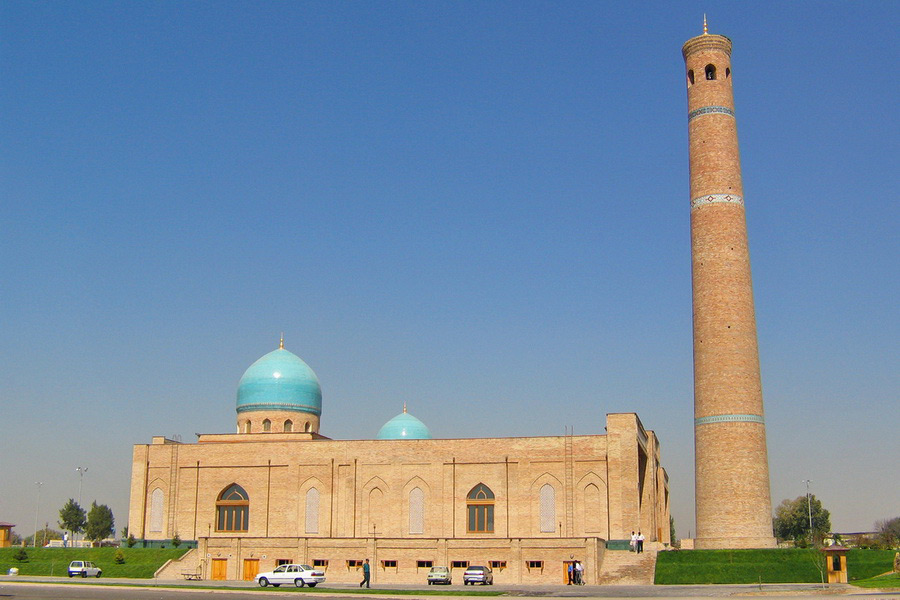
Locate an element on the screen. rectangular windows is located at coordinates (534, 563), (497, 567), (456, 566), (424, 564), (392, 567), (355, 563), (320, 563), (281, 564).